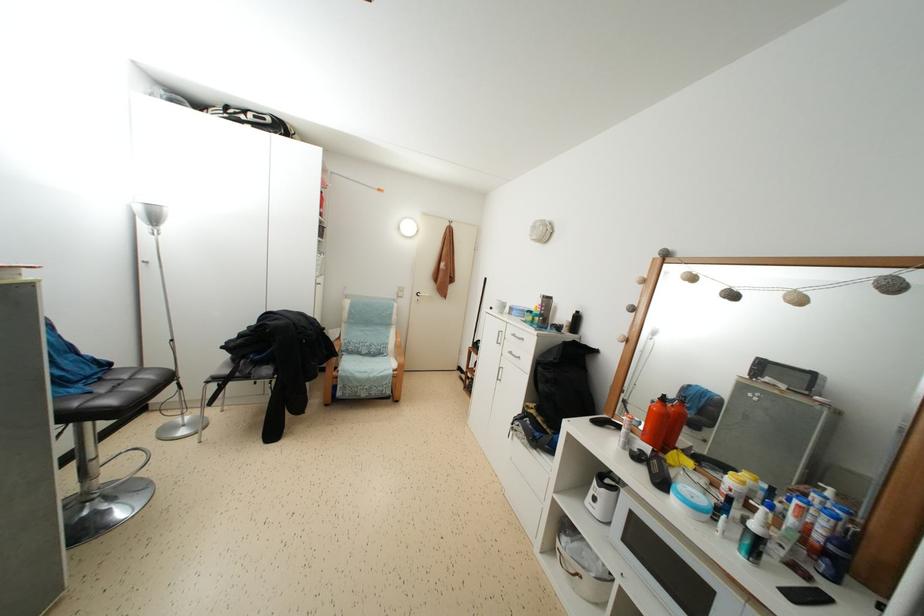
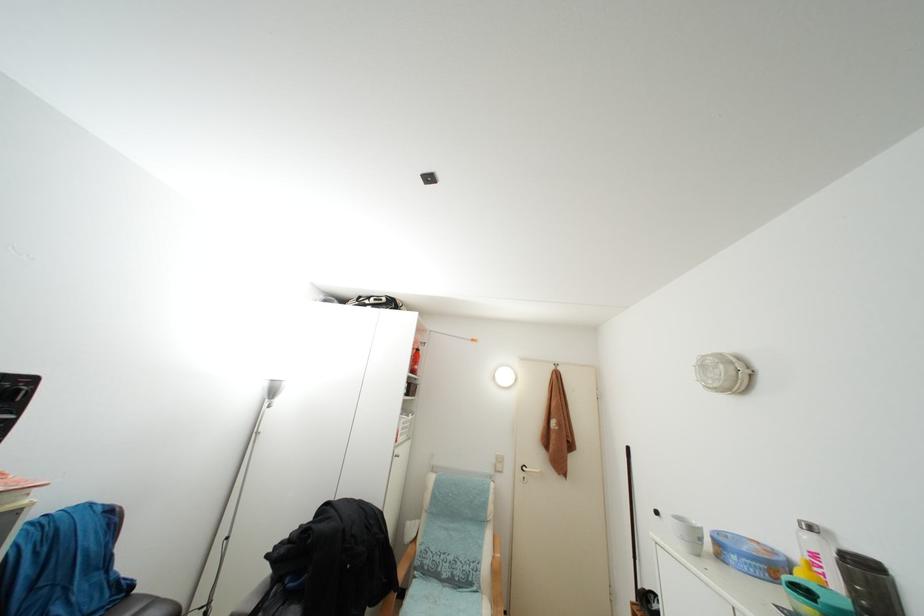
The first image is from the beginning of the video and the second image is from the end. How did the camera likely rotate when shooting the video?

The camera rotated toward left-up.